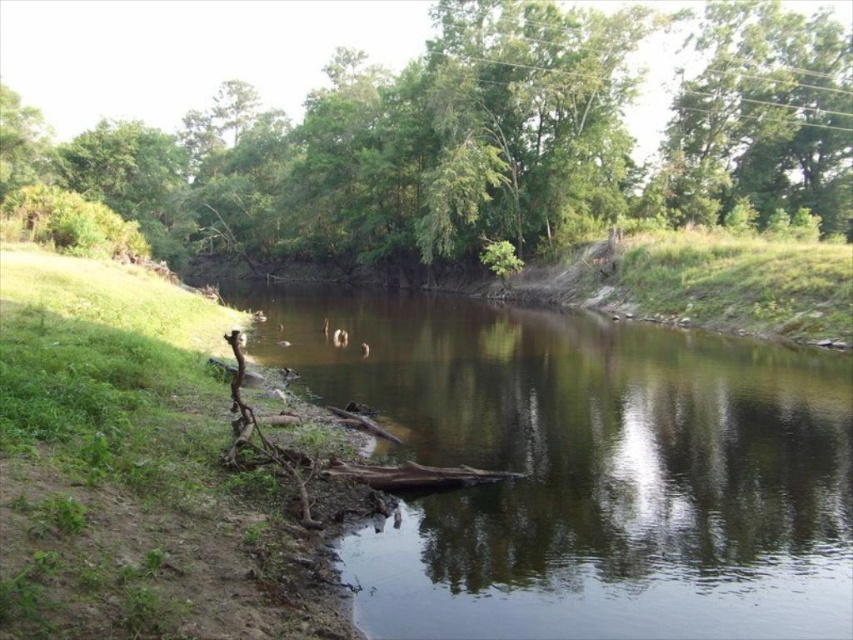
You are standing at the edge of the brown dirt river at center and want to reach the green leafy tree at center. Which direction should you walk to get closer to the tree without crossing the river?

The brown dirt river at center is thinner than the green leafy tree at center, so you should walk towards the wider side of the brown dirt river at center to approach the green leafy tree at center without crossing the river.